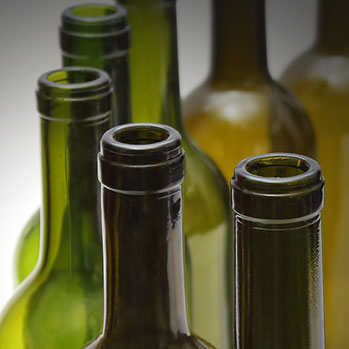
Where is `bottle`? bottle is located at coordinates (80, 303).